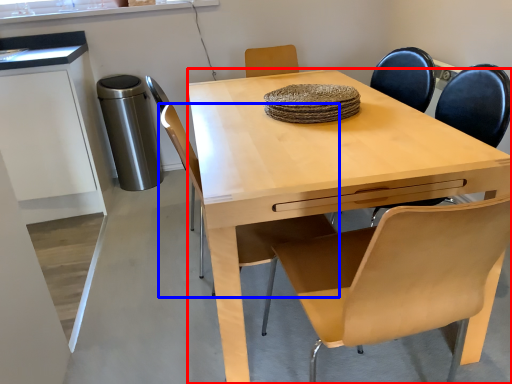
Question: Which of the following is the closest to the observer, desk (highlighted by a red box) or chair (highlighted by a blue box)?

Choices:
 (A) desk
 (B) chair

Answer: (A)